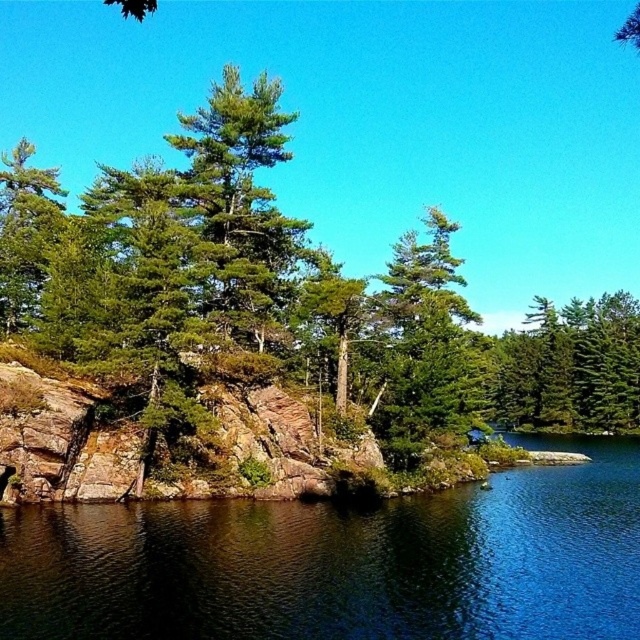
Does green matte tree at center appear over green matte tree at left?

Actually, green matte tree at center is below green matte tree at left.

Does green matte tree at center lie behind green matte tree at left?

No.

Does point (419, 324) lie in front of point (12, 189)?

Yes.

Where is `green matte tree at center`? The height and width of the screenshot is (640, 640). green matte tree at center is located at coordinates (424, 348).

Describe the element at coordinates (285, 298) in the screenshot. I see `green textured rock at center` at that location.

Can you confirm if green textured rock at center is thinner than green matte tree at left?

No.

This screenshot has width=640, height=640. In order to click on green textured rock at center in this screenshot , I will do `click(285, 298)`.

The image size is (640, 640). Find the location of `green textured rock at center`. green textured rock at center is located at coordinates (285, 298).

The width and height of the screenshot is (640, 640). Find the location of `green textured rock at center`. green textured rock at center is located at coordinates (285, 298).

Who is positioned more to the left, green textured rock at center or green matte tree at upper right?

green textured rock at center is more to the left.

Identify the location of green textured rock at center. (285, 298).